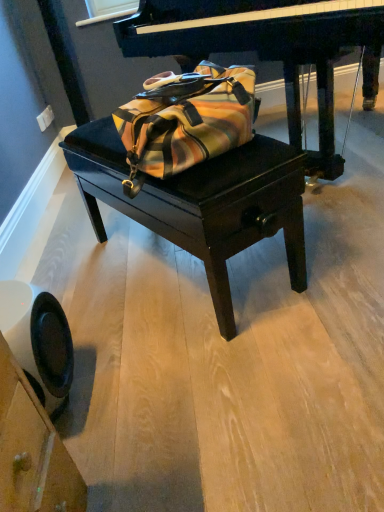
I want to click on unoccupied region to the right of velvet black table at center, so click(330, 241).